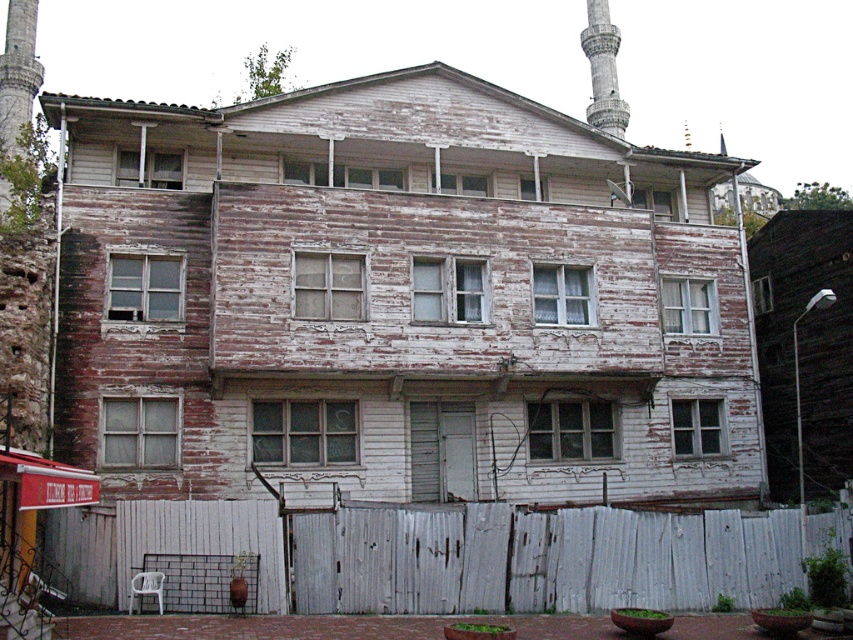
Question: Which point is farther from the camera taking this photo?

Choices:
 (A) (596, 60)
 (B) (700, 516)

Answer: (A)

Question: Does white wooden fence at lower center appear on the left side of gray stone minaret at upper right?

Choices:
 (A) yes
 (B) no

Answer: (A)

Question: Does white wooden fence at lower center have a larger size compared to gray stone minaret at upper right?

Choices:
 (A) yes
 (B) no

Answer: (B)

Question: Is white wooden fence at lower center bigger than gray stone minaret at upper right?

Choices:
 (A) no
 (B) yes

Answer: (A)

Question: Among these objects, which one is nearest to the camera?

Choices:
 (A) white wooden fence at lower center
 (B) gray stone minaret at upper right

Answer: (A)